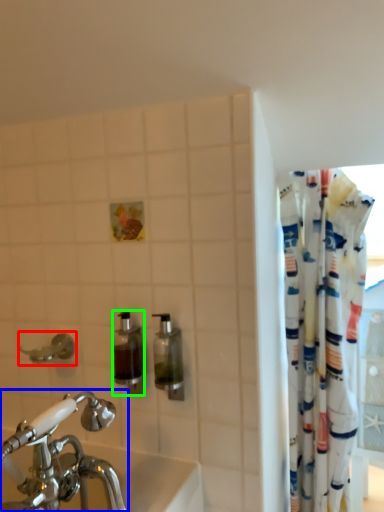
Question: Estimate the real-world distances between objects in this image. Which object is closer to plumbing fixture (highlighted by a red box), tap (highlighted by a blue box) or soap dispenser (highlighted by a green box)?

Choices:
 (A) tap
 (B) soap dispenser

Answer: (B)